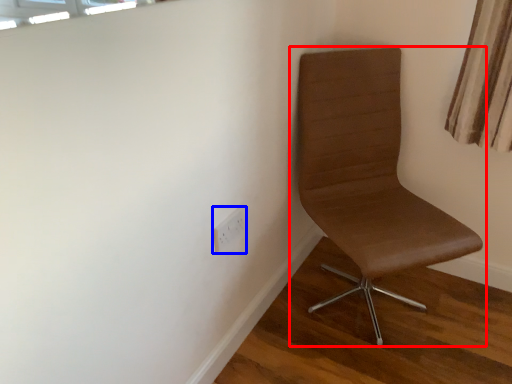
Question: Which of the following is the closest to the observer, chair (highlighted by a red box) or electric outlet (highlighted by a blue box)?

Choices:
 (A) chair
 (B) electric outlet

Answer: (A)